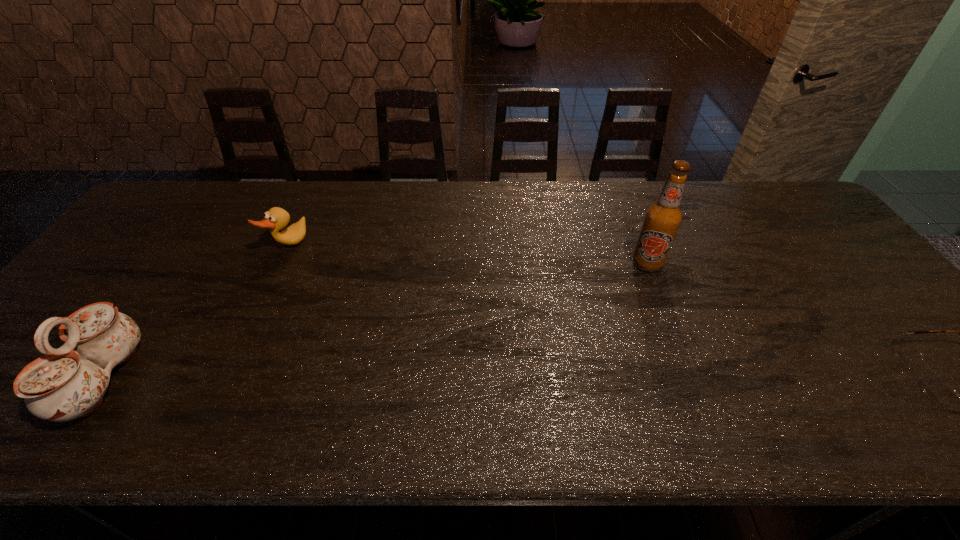
You are a GUI agent. You are given a task and a screenshot of the screen. Output one action in this format:
    pyautogui.click(x=<x>, y=<y>)
    Task: Click on the third shortest object
    
    Given the screenshot: What is the action you would take?
    pyautogui.click(x=66, y=383)

The height and width of the screenshot is (540, 960). Find the location of `chinaware`. chinaware is located at coordinates (66, 383).

Locate an element on the screen. the second shortest object is located at coordinates (276, 218).

You are a GUI agent. You are given a task and a screenshot of the screen. Output one action in this format:
    pyautogui.click(x=<x>, y=<y>)
    Task: Click on the third object from right to left
    
    Given the screenshot: What is the action you would take?
    pyautogui.click(x=276, y=218)

Where is `the third object from left to right`? This screenshot has height=540, width=960. the third object from left to right is located at coordinates (663, 218).

Locate an element on the screen. Image resolution: width=960 pixels, height=540 pixels. beer bottle is located at coordinates (663, 218).

Locate an element on the screen. vacant space located 0.170m by the handle of the chinaware is located at coordinates (x=210, y=379).

What are the coordinates of `blank space located on the beak of the second shortest object` in the screenshot? It's located at tap(338, 277).

Locate an element on the screen. The width and height of the screenshot is (960, 540). free space located 0.390m on the beak of the second shortest object is located at coordinates (402, 313).

In order to click on vacant space positioned on the beak of the second shortest object in this screenshot , I will do `click(391, 307)`.